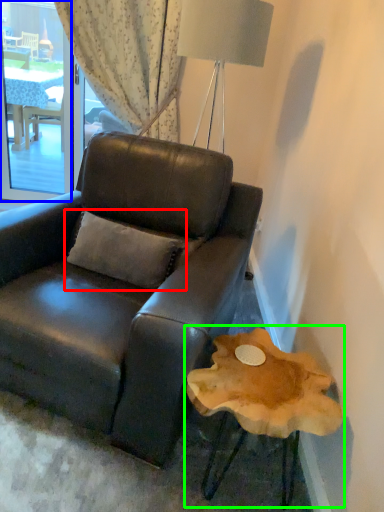
Question: Considering the real-world distances, which object is farthest from pillow (highlighted by a red box)? window screen (highlighted by a blue box) or round table (highlighted by a green box)?

Choices:
 (A) window screen
 (B) round table

Answer: (A)